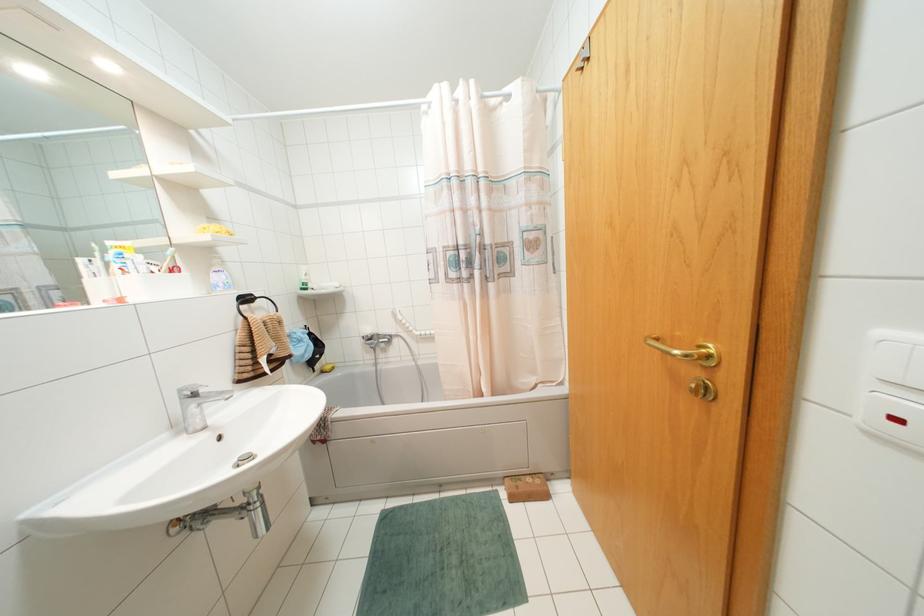
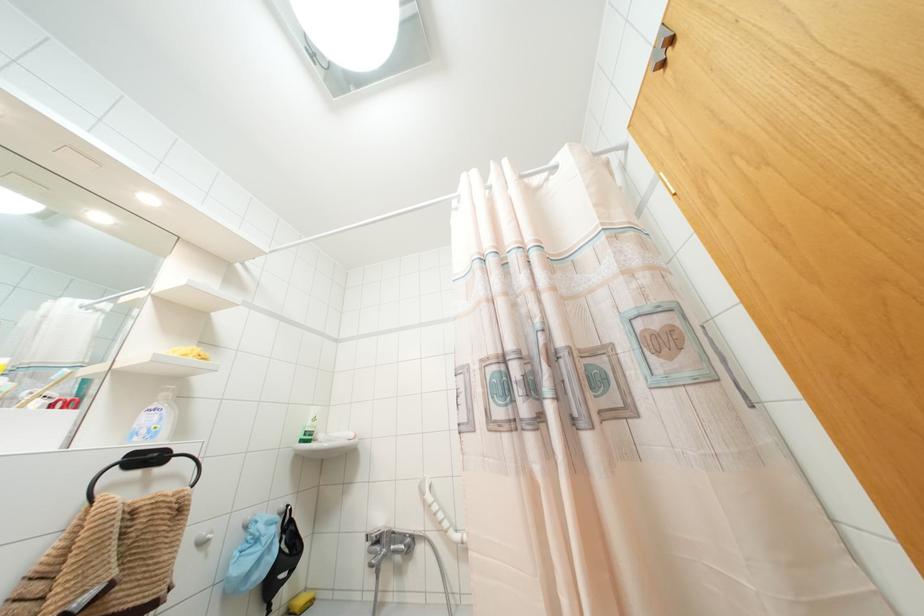
The first image is from the beginning of the video and the second image is from the end. How did the camera likely rotate when shooting the video?

The camera rotated toward left-up.